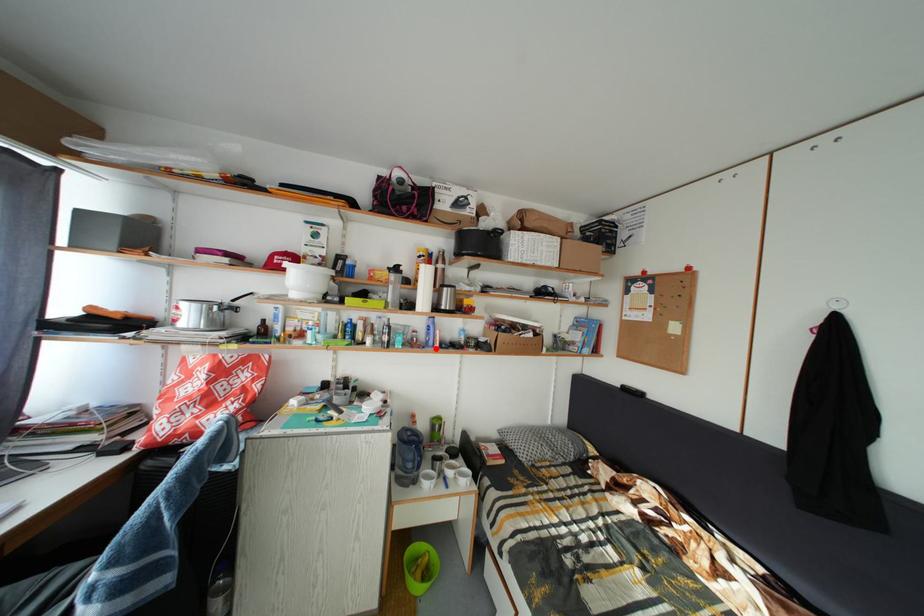
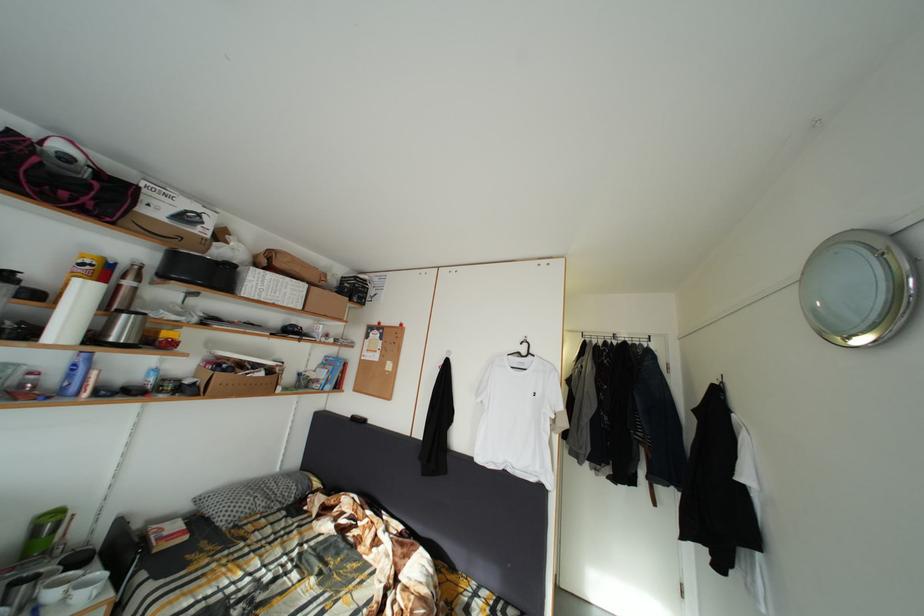
Find the pixel in the second image that matches the highlighted location in the first image.

(73, 395)